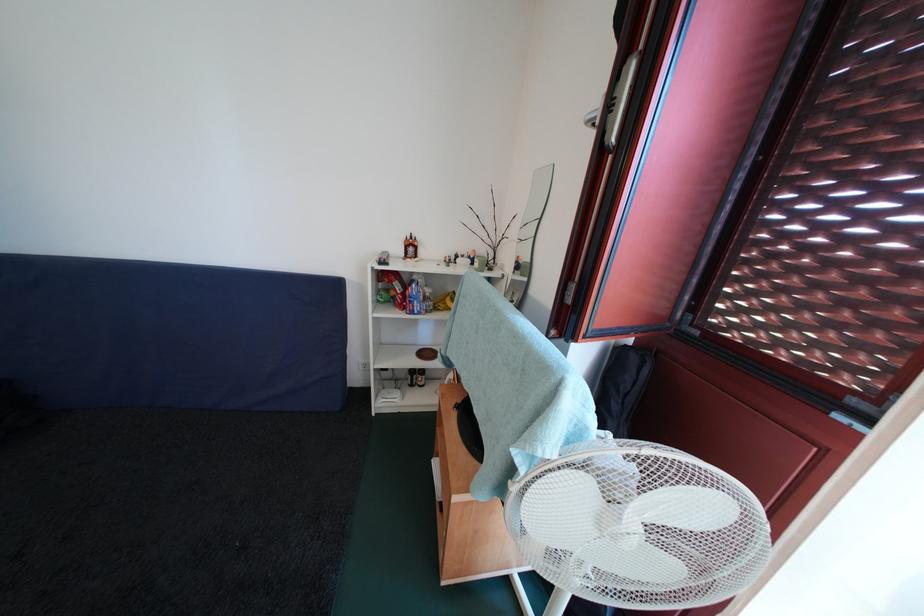
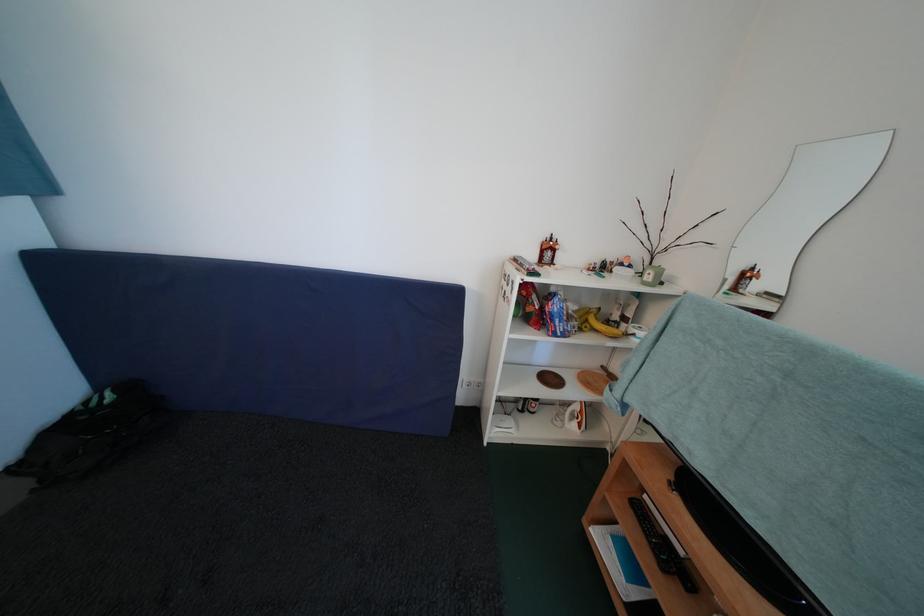
The images are taken continuously from a first-person perspective. In which direction are you moving?

The cameraman walked toward left, forward.